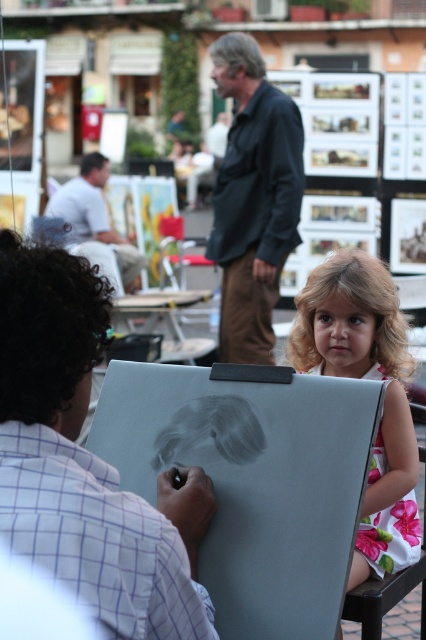
Question: Is matte white dress at lower right below white cotton shirt at upper left?

Choices:
 (A) yes
 (B) no

Answer: (A)

Question: Is matte white dress at lower right to the left of white cotton shirt at upper left from the viewer's perspective?

Choices:
 (A) yes
 (B) no

Answer: (B)

Question: Which object is closer to the camera taking this photo?

Choices:
 (A) white cotton shirt at upper left
 (B) matte white dress at lower right
 (C) dark gray shirt at center
 (D) floral cotton dress at right

Answer: (B)

Question: Which object is closer to the camera taking this photo?

Choices:
 (A) matte white dress at lower right
 (B) dark gray shirt at center
 (C) floral fabric chair at lower right
 (D) floral cotton dress at right

Answer: (A)

Question: Which object is closer to the camera taking this photo?

Choices:
 (A) dark gray shirt at center
 (B) floral fabric chair at lower right

Answer: (B)

Question: Can you confirm if dark gray shirt at center is positioned below white cotton shirt at upper left?

Choices:
 (A) yes
 (B) no

Answer: (A)